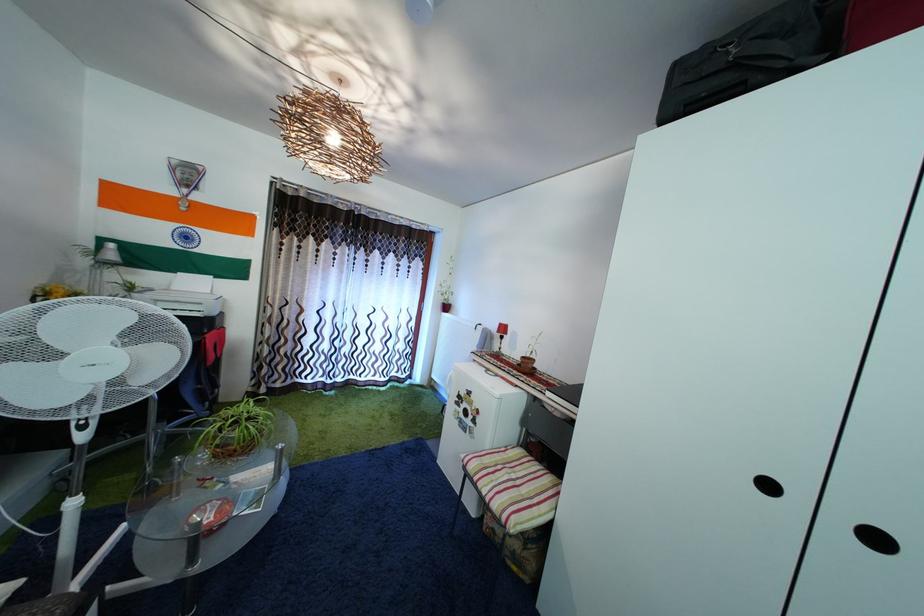
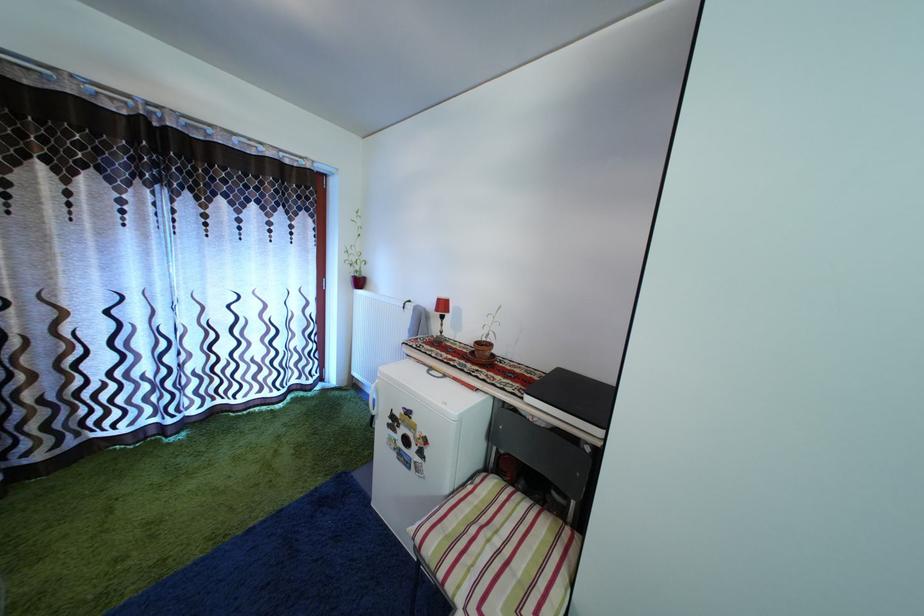
In the second image, find the point that corresponds to (x=508, y=331) in the first image.

(446, 308)